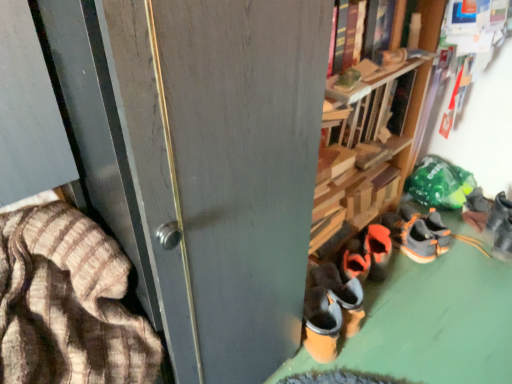
At what (x,y) coordinates should I click in order to perform the action: click on vacant point to the right of orange suede shoes at center, which ranks as the second footwear in left-to-right order. Please return your answer as a coordinate pair (x, y). The width and height of the screenshot is (512, 384). Looking at the image, I should click on (429, 276).